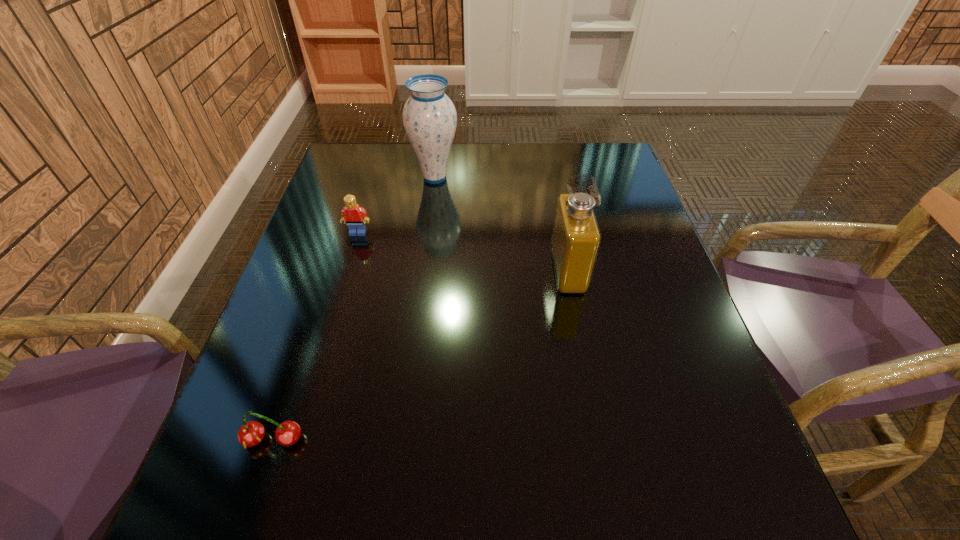
Locate an element on the screen. The image size is (960, 540). empty location between the Lego and the second tallest object is located at coordinates (463, 252).

Identify which object is the second nearest to the Lego. Please provide its 2D coordinates. Your answer should be formatted as a tuple, i.e. [(x, y)], where the tuple contains the x and y coordinates of a point satisfying the conditions above.

[(576, 237)]

Locate an element on the screen. The width and height of the screenshot is (960, 540). object identified as the second closest to the farthest object is located at coordinates (576, 237).

Where is `vacant region that satisfies the following two spatial constraints: 1. on the front-facing side of the third farthest object; 2. with stems pointing upwards on the shortest object`? vacant region that satisfies the following two spatial constraints: 1. on the front-facing side of the third farthest object; 2. with stems pointing upwards on the shortest object is located at coordinates (601, 440).